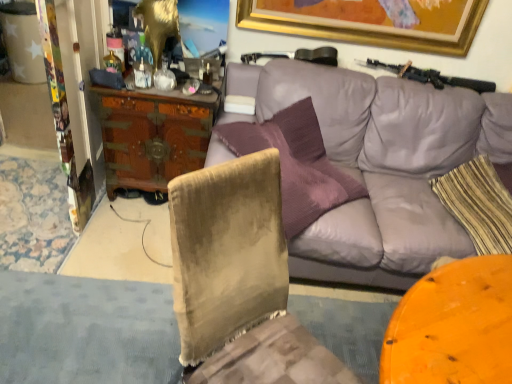
Question: Can you confirm if wooden carved desk at center left is smaller than purple leather couch at upper center?

Choices:
 (A) no
 (B) yes

Answer: (B)

Question: From the image's perspective, is wooden carved desk at center left under purple leather couch at upper center?

Choices:
 (A) no
 (B) yes

Answer: (A)

Question: Is the position of wooden carved desk at center left more distant than that of purple leather couch at upper center?

Choices:
 (A) no
 (B) yes

Answer: (B)

Question: Is wooden carved desk at center left next to purple leather couch at upper center?

Choices:
 (A) yes
 (B) no

Answer: (B)

Question: Is wooden carved desk at center left located outside purple leather couch at upper center?

Choices:
 (A) yes
 (B) no

Answer: (A)

Question: From the image's perspective, would you say wooden carved desk at center left is positioned over purple leather couch at upper center?

Choices:
 (A) no
 (B) yes

Answer: (B)

Question: Does purple leather couch at upper center have a lesser width compared to black matte shotgun at upper right?

Choices:
 (A) no
 (B) yes

Answer: (A)

Question: Is purple leather couch at upper center at the left side of black matte shotgun at upper right?

Choices:
 (A) no
 (B) yes

Answer: (B)

Question: Is the surface of purple leather couch at upper center in direct contact with black matte shotgun at upper right?

Choices:
 (A) yes
 (B) no

Answer: (B)

Question: Can you confirm if purple leather couch at upper center is shorter than black matte shotgun at upper right?

Choices:
 (A) no
 (B) yes

Answer: (A)

Question: From a real-world perspective, does purple leather couch at upper center sit lower than black matte shotgun at upper right?

Choices:
 (A) yes
 (B) no

Answer: (A)

Question: From a real-world perspective, is purple leather couch at upper center positioned over black matte shotgun at upper right based on gravity?

Choices:
 (A) no
 (B) yes

Answer: (A)

Question: Is striped fabric pillow at right positioned with its back to wooden carved desk at center left?

Choices:
 (A) no
 (B) yes

Answer: (A)